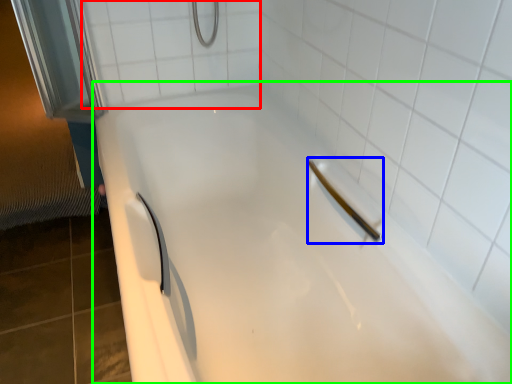
Question: Which is nearer to the ceramic tile (highlighted by a red box)? shower (highlighted by a blue box) or bathtub (highlighted by a green box).

Choices:
 (A) shower
 (B) bathtub

Answer: (B)